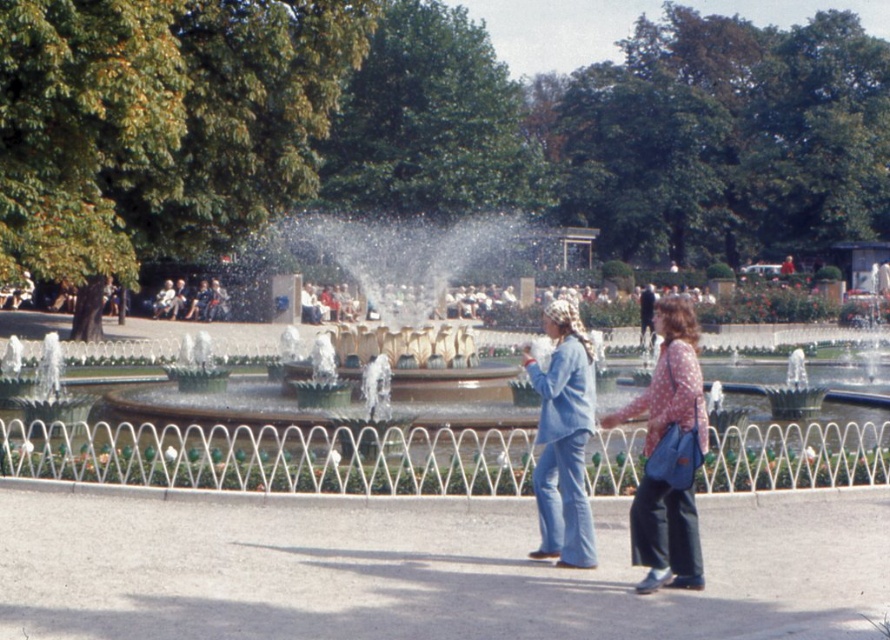
You are a fashion designer observing the two people in the park scene. You notice the polka dot fabric blouse at center and the matte black jacket at center. Which clothing item appears to be made from a thinner material?

The polka dot fabric blouse at center is thinner than the matte black jacket at center, so the polka dot fabric blouse at center is made from a thinner material.

You are a photographer standing at the park entrance and want to capture the polka dot fabric blouse at center in your photo. Given that the camera has a focal length of 50mm and you are 10 meters away from the blouse, will the blouse appear larger or smaller in the photo compared to its actual size?

The polka dot fabric blouse at center is positioned at coordinates point (669, 456), so the distance from the camera does not affect the apparent size in the photo since focal length and distance determine magnification. However, without knowing the actual size of the blouse, we cannot definitively say if it appears larger or smaller.

Consider the image. You are standing at the fountain and looking towards the two points marked in the park. Which point, point (692, 392) or point (204, 320), is closer to you?

Point (692, 392) is in front of point (204, 320), so it is closer to you.